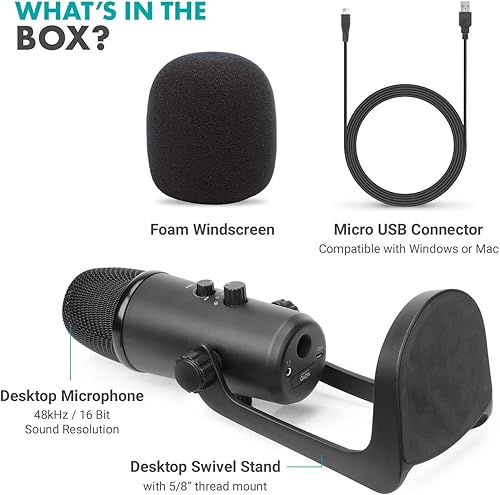
Where is `knob`? knob is located at coordinates (207, 287).